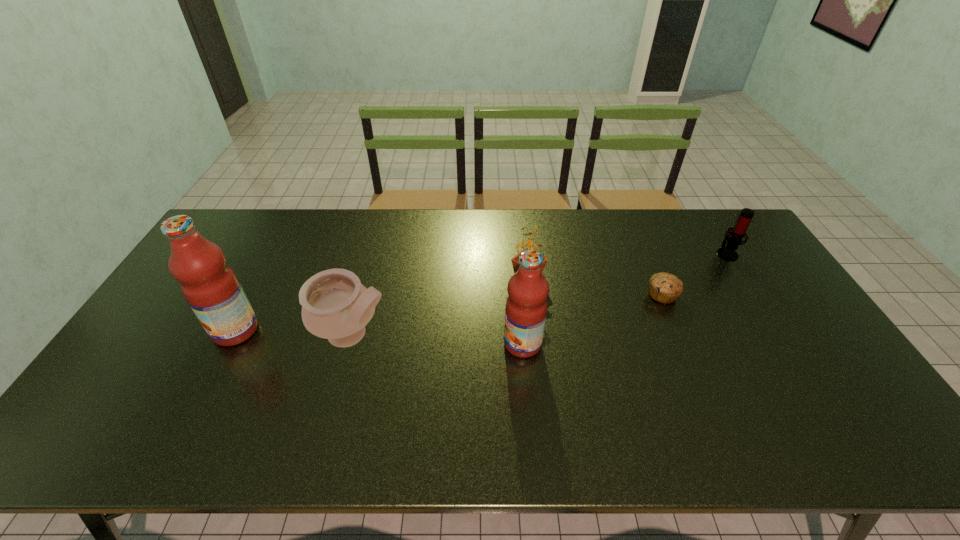
Image resolution: width=960 pixels, height=540 pixels. Identify the location of the tallest object. (211, 288).

Find the location of `the taller fruit juice`. the taller fruit juice is located at coordinates (211, 288).

Locate an element on the screen. Image resolution: width=960 pixels, height=540 pixels. the second tallest object is located at coordinates (526, 306).

Find the location of `the right fruit juice`. the right fruit juice is located at coordinates (526, 306).

Locate an element on the screen. This screenshot has height=540, width=960. microphone is located at coordinates (731, 241).

Locate an element on the screen. The height and width of the screenshot is (540, 960). the farthest object is located at coordinates (731, 241).

Find the location of a particular element. muffin is located at coordinates (664, 287).

Image resolution: width=960 pixels, height=540 pixels. Find the location of `the shortest object`. the shortest object is located at coordinates (x=664, y=287).

Locate an element on the screen. The width and height of the screenshot is (960, 540). sunflower is located at coordinates (515, 260).

The height and width of the screenshot is (540, 960). What are the coordinates of `the second object from left to right` in the screenshot? It's located at (335, 305).